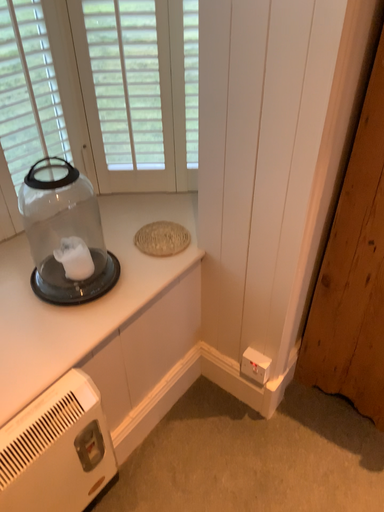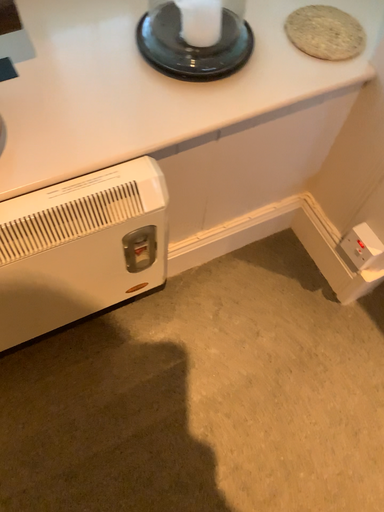
Question: Which way did the camera rotate in the video?

Choices:
 (A) rotated downward
 (B) rotated upward

Answer: (A)